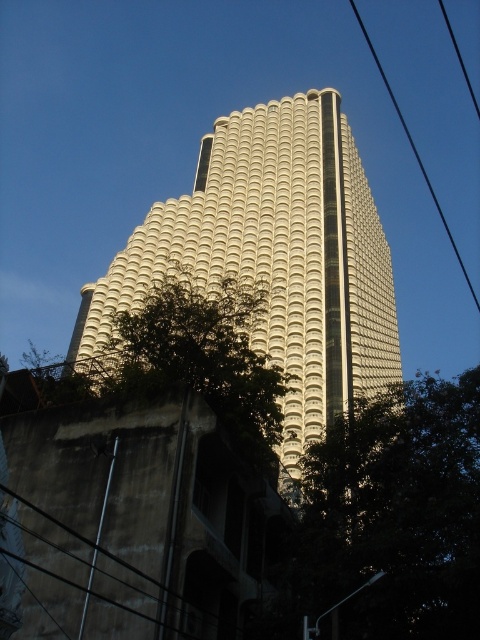
Question: Is white textured building at center thinner than green leafy tree at center?

Choices:
 (A) no
 (B) yes

Answer: (A)

Question: Is white textured building at center below green leafy tree at lower right?

Choices:
 (A) no
 (B) yes

Answer: (A)

Question: Among these points, which one is nearest to the camera?

Choices:
 (A) (359, 20)
 (B) (252, 444)

Answer: (B)

Question: Among these points, which one is farthest from the camera?

Choices:
 (A) (372, 52)
 (B) (242, 454)

Answer: (A)

Question: Which point is farther to the camera?

Choices:
 (A) (429, 180)
 (B) (243, 321)
 (C) (324, 488)
 (D) (130, 276)

Answer: (A)

Question: Does green leafy tree at center appear over black wire at upper right?

Choices:
 (A) yes
 (B) no

Answer: (B)